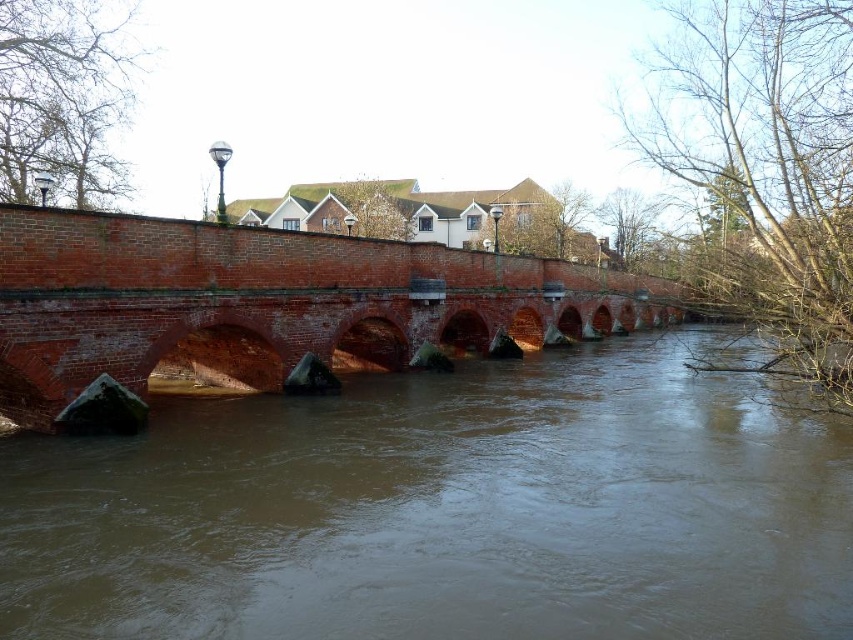
Between point (9, 573) and point (7, 220), which one is positioned in front?

Point (9, 573) is more forward.

Image resolution: width=853 pixels, height=640 pixels. Identify the location of brown clay river at center. (444, 509).